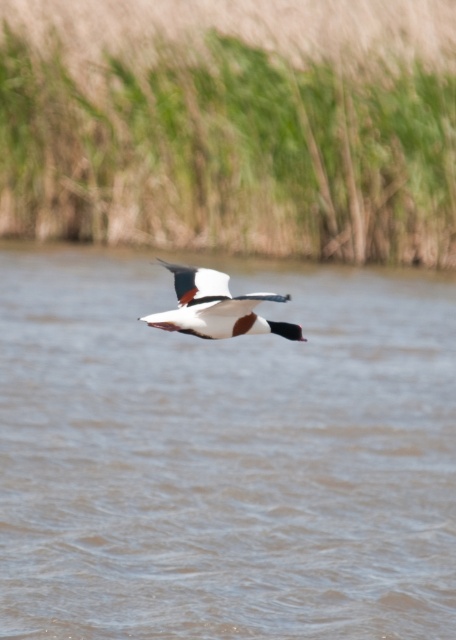
You are a photographer trying to capture the white glossy bird at center in your shot. You notice the green grass at upper center might be blocking part of the bird. Based on their heights, will the grass obscure the bird?

The green grass at upper center is shorter than the white glossy bird at center, so it will not obscure the bird.

You are standing on the lakeshore and see the green grass at upper center and the white glossy bird at center. Which object is closer to your left side?

The green grass at upper center is positioned on the left side of the white glossy bird at center, so it is closer to your left side.

You are a photographer trying to capture the Shelduck in flight. You notice the brown water at center and the green grass at upper center in your viewfinder. Which of these two elements is wider in the image?

The brown water at center is wider than the green grass at upper center.